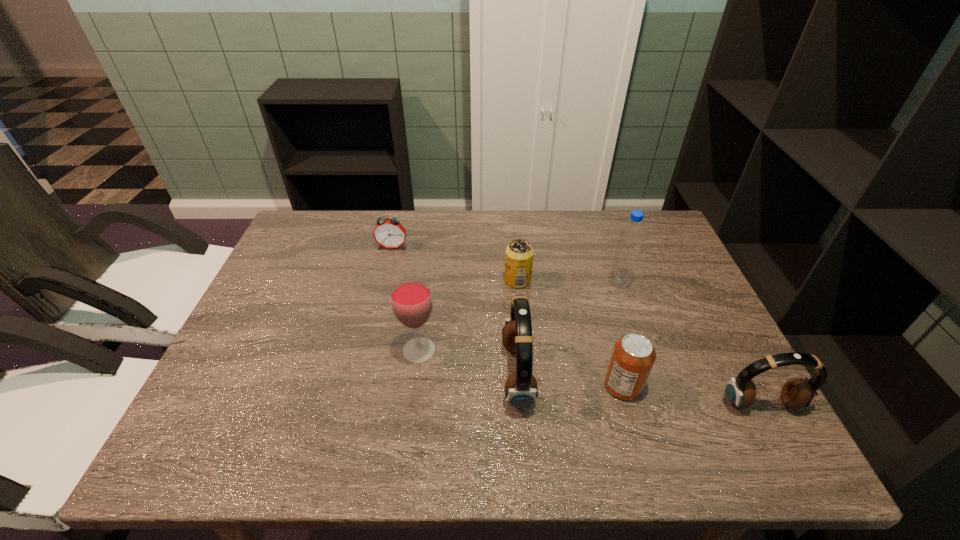
Where is `vacant spot to place a headset on the left`? This screenshot has height=540, width=960. vacant spot to place a headset on the left is located at coordinates (300, 349).